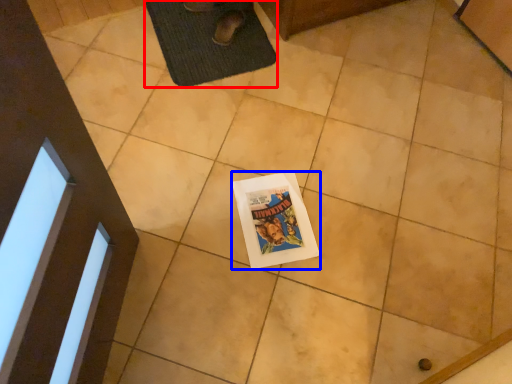
Question: Which object is further to the camera taking this photo, bath mat (highlighted by a red box) or comic book (highlighted by a blue box)?

Choices:
 (A) bath mat
 (B) comic book

Answer: (A)